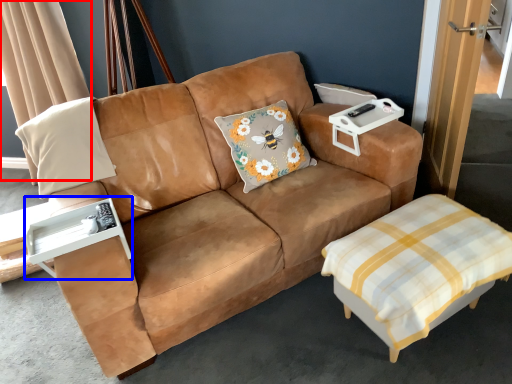
Question: Among these objects, which one is farthest to the camera, curtain (highlighted by a red box) or side table (highlighted by a blue box)?

Choices:
 (A) curtain
 (B) side table

Answer: (A)